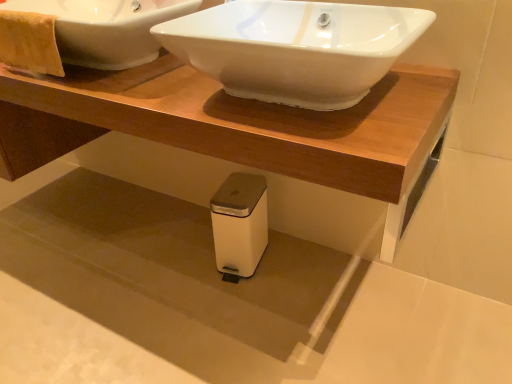
At what (x,y) coordinates should I click in order to perform the action: click on free space that is to the left of white matte trash can at lower center. Please return your answer as a coordinate pair (x, y). This screenshot has width=512, height=384. Looking at the image, I should click on (183, 266).